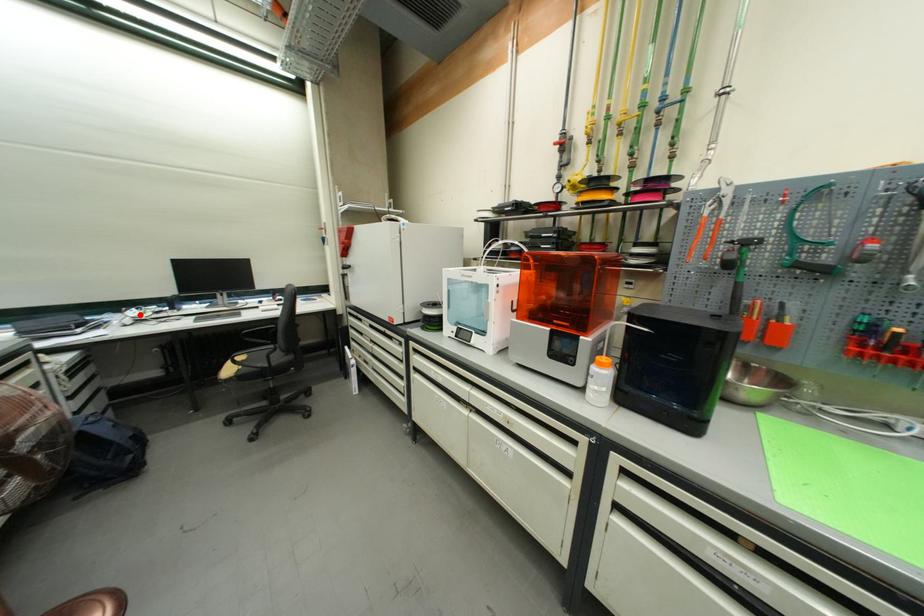
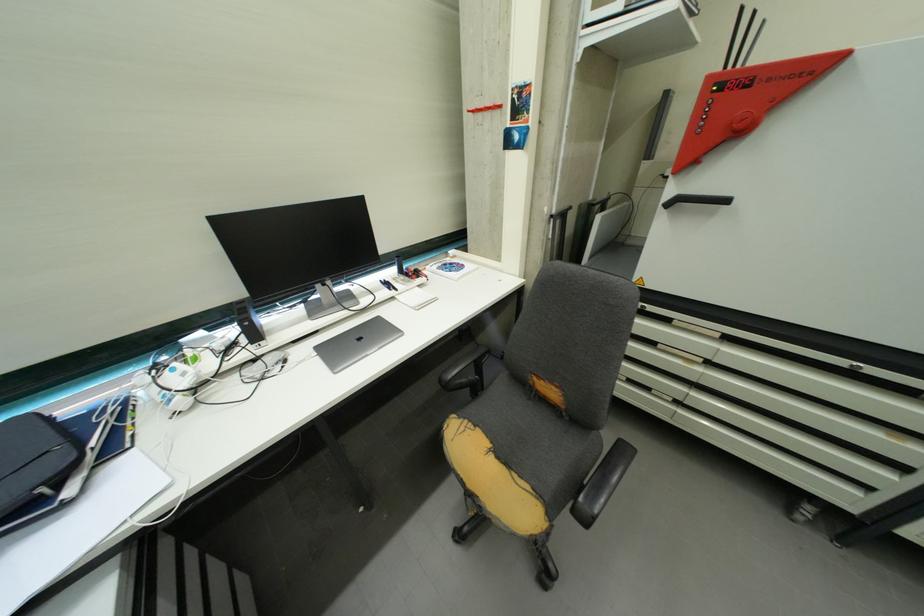
Locate, in the second image, the point that corresponds to the highlighted location in the first image.

(189, 376)